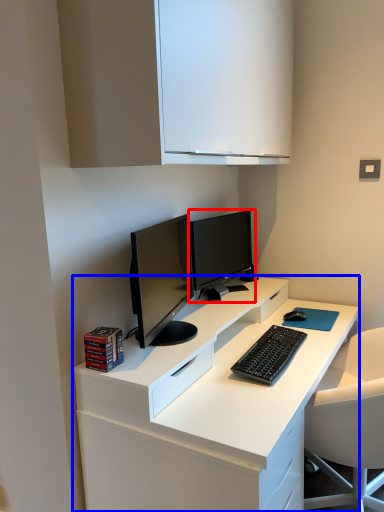
Question: Which point is closer to the camera, computer monitor (highlighted by a red box) or desk (highlighted by a blue box)?

Choices:
 (A) computer monitor
 (B) desk

Answer: (B)